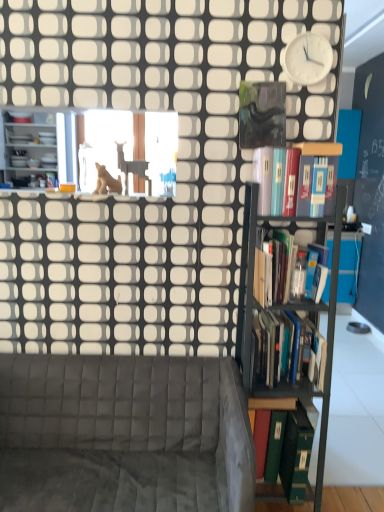
Question: Is hardcover book at upper right, positioned as the first book in top-to-bottom order, in front of or behind velvet grey couch at lower left in the image?

Choices:
 (A) behind
 (B) front

Answer: (A)

Question: Is hardcover book at upper right, positioned as the first book in top-to-bottom order, wider or thinner than velvet grey couch at lower left?

Choices:
 (A) thin
 (B) wide

Answer: (A)

Question: Which of these objects is positioned farthest from the green matte book at right, the 1th book in the bottom-to-top sequence?

Choices:
 (A) matte beige cat at upper center
 (B) black metal bookshelf at right
 (C) white plastic clock at upper right
 (D) hardcover book at upper right, acting as the fourth book starting from the bottom
 (E) hardcover books at right, positioned as the second book in bottom-to-top order

Answer: (C)

Question: Which object is the farthest from the white plastic clock at upper right?

Choices:
 (A) hardcover book at upper right, acting as the fourth book starting from the bottom
 (B) black metal bookshelf at right
 (C) green matte book at right, the 1th book in the bottom-to-top sequence
 (D) hardcover books at right, marked as the second book in a top-to-bottom arrangement
 (E) matte beige cat at upper center

Answer: (C)